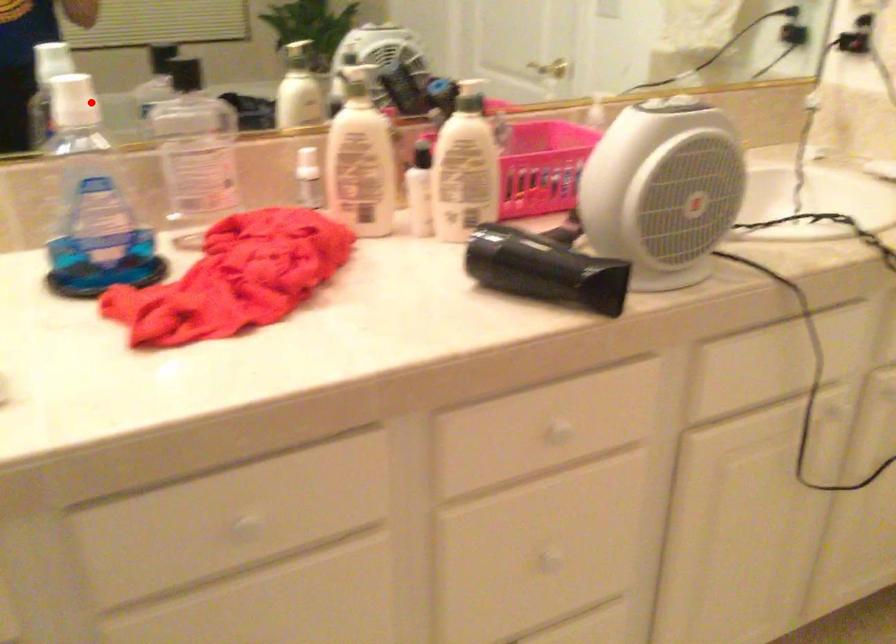
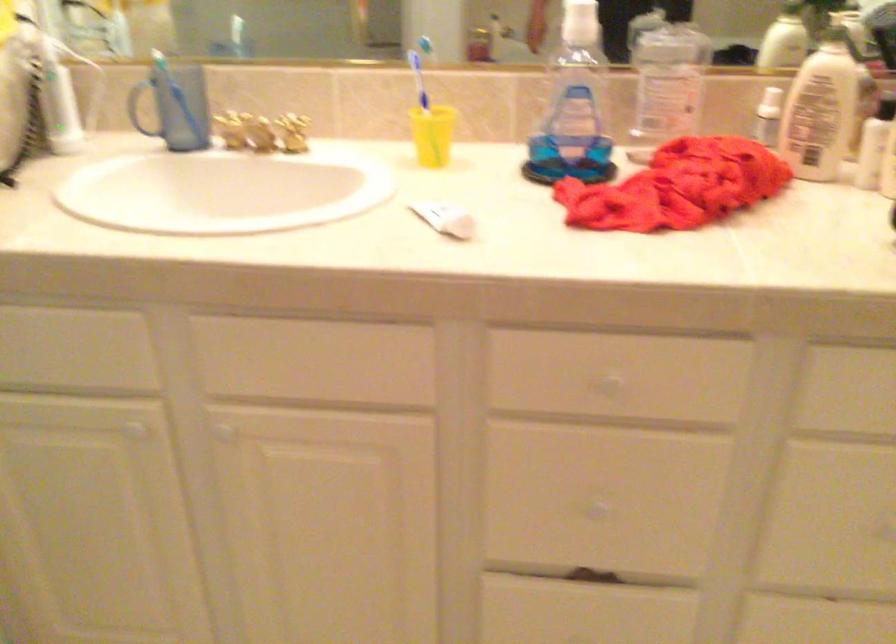
Question: I am providing you with two images of the same scene from different viewpoints. In image1, a red point is highlighted. Considering the same 3D point in image2, which of the following is correct?

Choices:
 (A) It is closer
 (B) It is farther

Answer: (B)